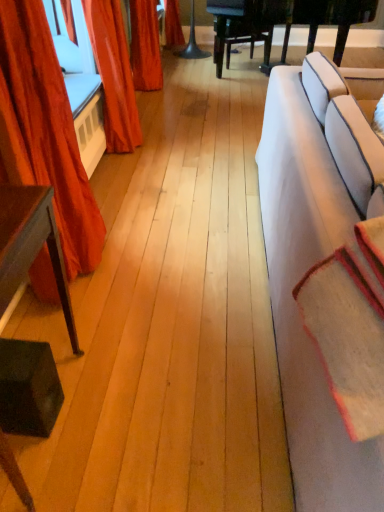
Question: Is dark brown wood table at left surrounded by beige woolen blanket at right?

Choices:
 (A) yes
 (B) no

Answer: (B)

Question: From a real-world perspective, is beige woolen blanket at right over dark brown wood table at left?

Choices:
 (A) yes
 (B) no

Answer: (A)

Question: Does beige woolen blanket at right have a lesser height compared to dark brown wood table at left?

Choices:
 (A) yes
 (B) no

Answer: (A)

Question: From a real-world perspective, is beige woolen blanket at right beneath dark brown wood table at left?

Choices:
 (A) yes
 (B) no

Answer: (B)

Question: Considering the relative positions of beige woolen blanket at right and dark brown wood table at left in the image provided, is beige woolen blanket at right to the left of dark brown wood table at left from the viewer's perspective?

Choices:
 (A) yes
 (B) no

Answer: (B)

Question: Is beige woolen blanket at right placed right next to dark brown wood table at left?

Choices:
 (A) no
 (B) yes

Answer: (A)

Question: Can you confirm if velvet orange curtain at upper left, which appears as the first curtain when viewed from the back, is wider than dark brown wood table at left?

Choices:
 (A) no
 (B) yes

Answer: (A)

Question: From the image's perspective, does velvet orange curtain at upper left, positioned as the second curtain in front-to-back order, appear lower than dark brown wood table at left?

Choices:
 (A) yes
 (B) no

Answer: (B)

Question: Can you confirm if velvet orange curtain at upper left, positioned as the second curtain in front-to-back order, is positioned to the right of dark brown wood table at left?

Choices:
 (A) no
 (B) yes

Answer: (B)

Question: Could you tell me if velvet orange curtain at upper left, positioned as the second curtain in front-to-back order, is facing dark brown wood table at left?

Choices:
 (A) no
 (B) yes

Answer: (A)

Question: Is velvet orange curtain at upper left, positioned as the second curtain in front-to-back order, further to camera compared to dark brown wood table at left?

Choices:
 (A) no
 (B) yes

Answer: (B)

Question: Can you confirm if velvet orange curtain at upper left, positioned as the second curtain in front-to-back order, is bigger than dark brown wood table at left?

Choices:
 (A) yes
 (B) no

Answer: (A)

Question: Is velvet orange curtain at upper left, which appears as the first curtain when viewed from the back, closer to the viewer compared to velvet red curtain at left, the 1th curtain viewed from the front?

Choices:
 (A) no
 (B) yes

Answer: (A)